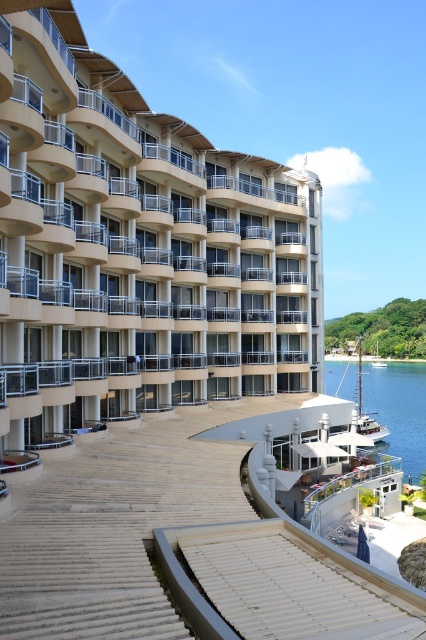
You are standing on the wide staircase leading down to the waterfront. You see the clear blue water at lower right and the white wooden sailboat at lower right. Which one is closer to you?

The clear blue water at lower right is closer to you because it is further to the viewer than the white wooden sailboat at lower right.

You are standing at the point marked by coordinate (x=138, y=248), which is part of the beige concrete building at center. If you look towards the waterfront area, which direction should you face?

The beige concrete building at center is represented by point (x=138, y=248). Since the waterfront area is located in the lower part of the image, facing downward from the point would direct you towards the waterfront area.